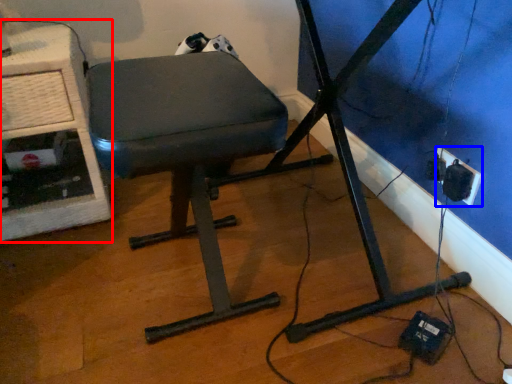
Question: Which object is further to the camera taking this photo, computer desk (highlighted by a red box) or electric outlet (highlighted by a blue box)?

Choices:
 (A) computer desk
 (B) electric outlet

Answer: (B)